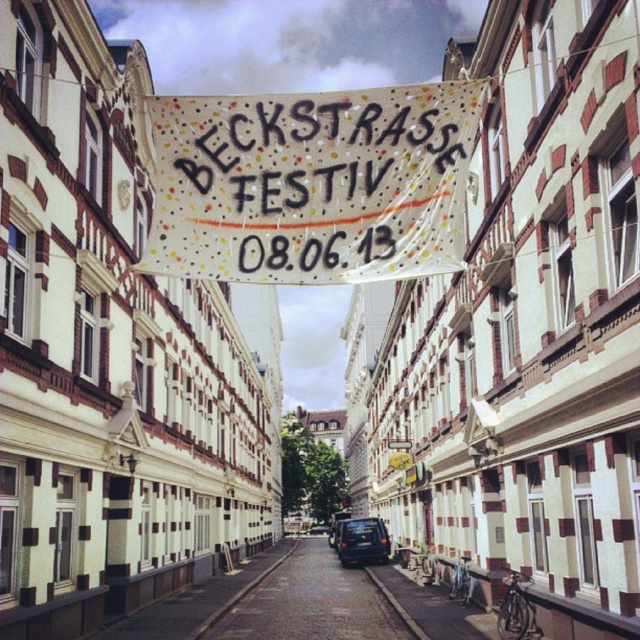
What is located at the point with coordinates (308, 602) in the image?

The point with coordinates (308, 602) corresponds to dark gray asphalt at center.

You are a pedestrian walking down the narrow street and want to cross to the other side. The white fabric banner at center and the dark gray asphalt at center are both in your path. Which object will you need to step over or under to reach the other side?

The white fabric banner at center is in front of dark gray asphalt at center, so you will need to step under the white fabric banner at center to reach the other side.